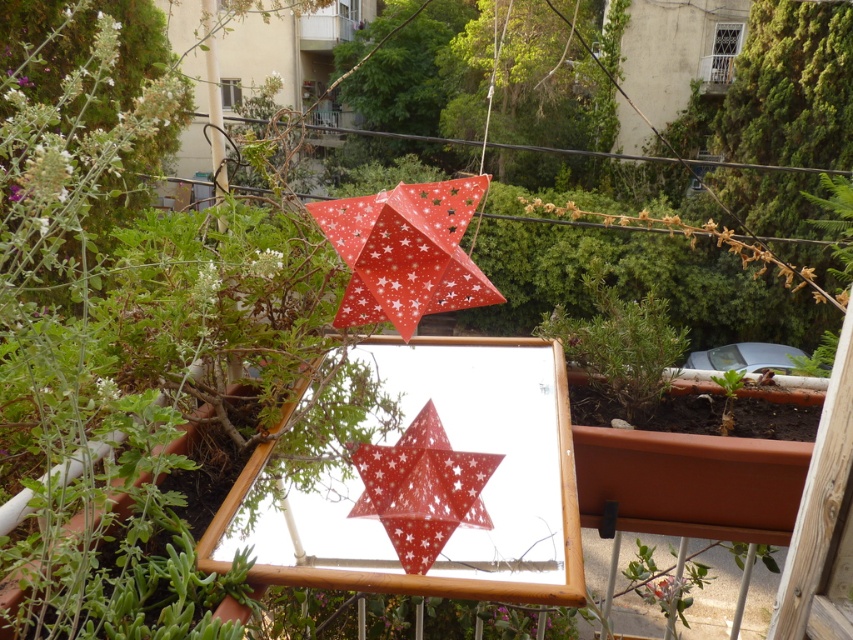
Question: Which point is closer to the camera taking this photo?

Choices:
 (A) (631, 394)
 (B) (387, 460)

Answer: (B)

Question: From the image, what is the correct spatial relationship of red paper star at upper center in relation to green leafy plant at center?

Choices:
 (A) above
 (B) below

Answer: (B)

Question: Which point is farther from the camera taking this photo?

Choices:
 (A) (460, 476)
 (B) (619, 320)

Answer: (B)

Question: Can you confirm if red paper star at upper center is bigger than green leafy plant at center?

Choices:
 (A) yes
 (B) no

Answer: (B)

Question: Does red paper star at upper center have a smaller size compared to green leafy plant at center?

Choices:
 (A) no
 (B) yes

Answer: (B)

Question: Which of the following is the closest to the observer?

Choices:
 (A) (651, 410)
 (B) (428, 513)

Answer: (B)